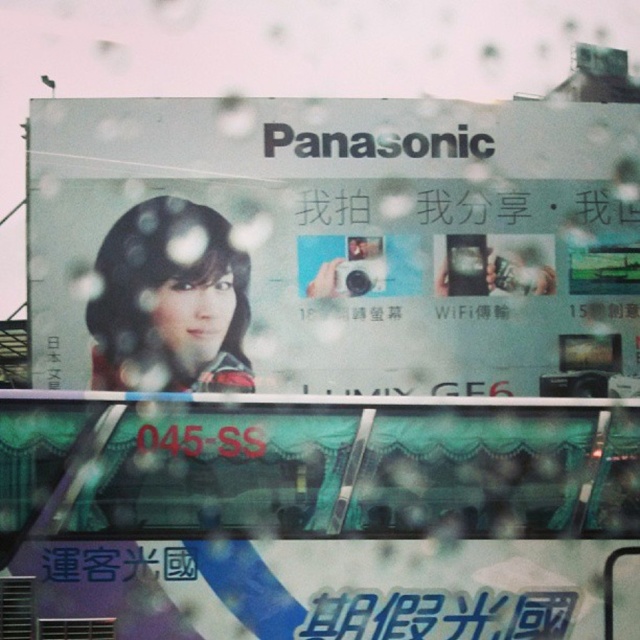
Question: From the image, what is the correct spatial relationship of teal fabric covered bus at lower center in relation to white glossy text at lower center?

Choices:
 (A) right
 (B) left

Answer: (B)

Question: Which point appears closest to the camera in this image?

Choices:
 (A) (468, 326)
 (B) (465, 614)

Answer: (B)

Question: Considering the relative positions of matte silver camera at center and white glossy text at lower center in the image provided, where is matte silver camera at center located with respect to white glossy text at lower center?

Choices:
 (A) right
 (B) left

Answer: (B)

Question: Which point is farther from the camera taking this photo?

Choices:
 (A) (472, 624)
 (B) (337, 108)
 (C) (54, 472)

Answer: (B)

Question: Is teal fabric covered bus at lower center to the right of white glossy text at lower center from the viewer's perspective?

Choices:
 (A) no
 (B) yes

Answer: (A)

Question: Which of these objects is positioned closest to the white glossy text at lower center?

Choices:
 (A) teal fabric covered bus at lower center
 (B) matte silver camera at center

Answer: (A)